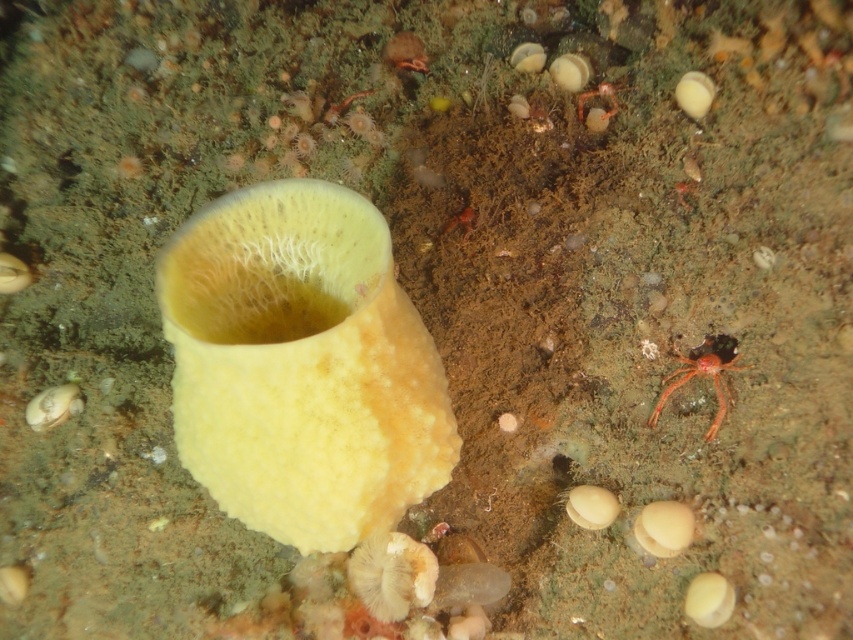
Question: Does translucent orange spider at lower right appear under translucent orange crab at upper center?

Choices:
 (A) yes
 (B) no

Answer: (A)

Question: Is translucent orange spider at lower right thinner than translucent orange crab at upper center?

Choices:
 (A) yes
 (B) no

Answer: (B)

Question: Which object is farther from the camera taking this photo?

Choices:
 (A) translucent orange crab at upper center
 (B) translucent orange spider at lower right

Answer: (A)

Question: Which of the following is the closest to the observer?

Choices:
 (A) 730,340
 (B) 583,92

Answer: (A)

Question: Can you confirm if translucent orange spider at lower right is wider than translucent orange crab at upper center?

Choices:
 (A) yes
 (B) no

Answer: (A)

Question: Among these objects, which one is nearest to the camera?

Choices:
 (A) translucent orange spider at lower right
 (B) translucent orange crab at upper center

Answer: (A)